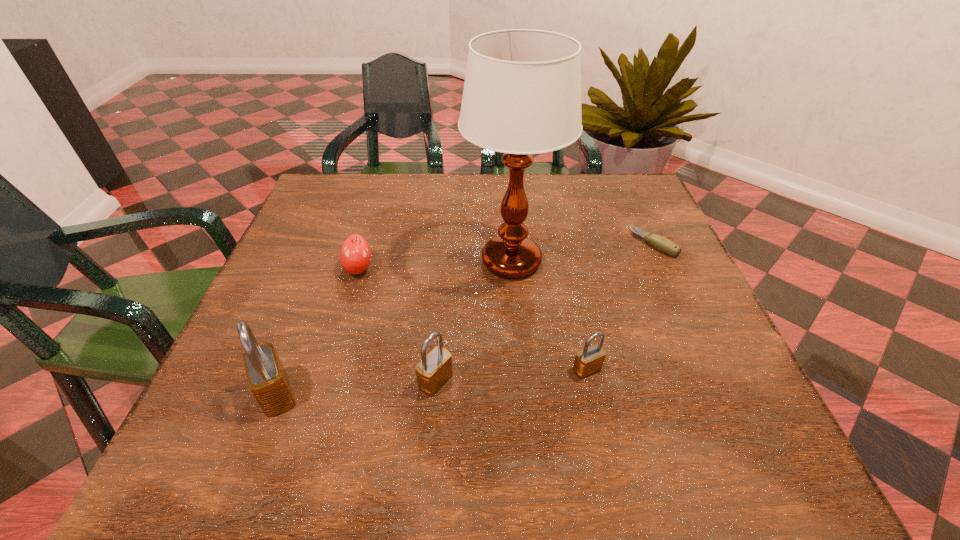
Identify the location of vacant space that is in between the tallest object and the second padlock from right to left. The width and height of the screenshot is (960, 540). (473, 321).

Identify which object is the nearest to the fourth shortest object. Please provide its 2D coordinates. Your answer should be formatted as a tuple, i.e. [(x, y)], where the tuple contains the x and y coordinates of a point satisfying the conditions above.

[(522, 92)]

The width and height of the screenshot is (960, 540). Identify the location of object that is the second closest to the table lamp. (435, 368).

Image resolution: width=960 pixels, height=540 pixels. I want to click on padlock that is the third closest to the apple, so click(x=589, y=360).

At what (x,y) coordinates should I click in order to perform the action: click on padlock that stands as the third closest to the second object from left to right. Please return your answer as a coordinate pair (x, y). Looking at the image, I should click on (589, 360).

Find the location of a particular element. free space in the image that satisfies the following two spatial constraints: 1. on the back side of the fifth object from right to left; 2. on the right side of the shortest object is located at coordinates (367, 243).

You are a GUI agent. You are given a task and a screenshot of the screen. Output one action in this format:
    pyautogui.click(x=<x>, y=<y>)
    Task: Click on the free space in the image that satisfies the following two spatial constraints: 1. on the back side of the shortest padlock; 2. on the left side of the leftmost object
    
    Given the screenshot: What is the action you would take?
    pyautogui.click(x=286, y=369)